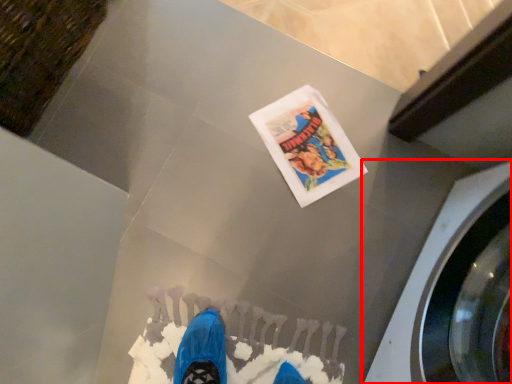
Question: From the image's perspective, where is washing machine (annotated by the red box) located relative to flyer?

Choices:
 (A) below
 (B) above

Answer: (A)